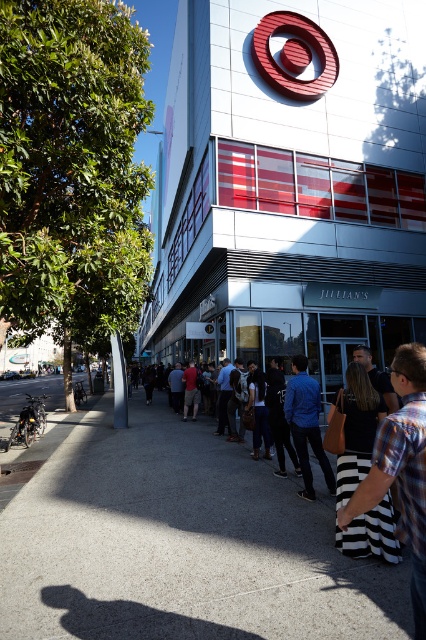
Where is `striped fabric skirt at lower right`? striped fabric skirt at lower right is located at coordinates (402, 468).

Which is behind, point (411, 371) or point (298, 452)?

Positioned behind is point (298, 452).

Which is in front, point (400, 394) or point (298, 380)?

Point (400, 394) is in front.

Find the location of a particular element. The width and height of the screenshot is (426, 640). striped fabric skirt at lower right is located at coordinates (402, 468).

Looking at this image, can you confirm if gray concrete sidewalk at center is positioned to the left of red shirt at center?

Correct, you'll find gray concrete sidewalk at center to the left of red shirt at center.

Can you confirm if gray concrete sidewalk at center is smaller than red shirt at center?

Incorrect, gray concrete sidewalk at center is not smaller in size than red shirt at center.

Does point (367, 563) come behind point (187, 369)?

That is False.

Find the location of `gray concrete sidewalk at center`. gray concrete sidewalk at center is located at coordinates (181, 545).

Is white glass building at center to the right of striped fabric skirt at lower right from the viewer's perspective?

Incorrect, white glass building at center is not on the right side of striped fabric skirt at lower right.

Find the location of a particular element. white glass building at center is located at coordinates (290, 182).